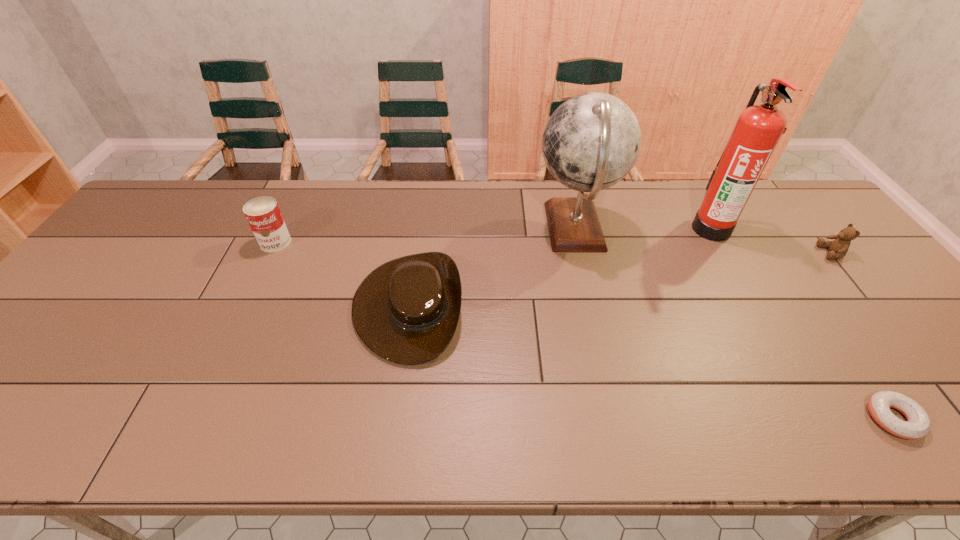
Select which object appears as the closest to the fourth object from right to left. Please provide its 2D coordinates. Your answer should be formatted as a tuple, i.e. [(x, y)], where the tuple contains the x and y coordinates of a point satisfying the conditions above.

[(407, 310)]

At what (x,y) coordinates should I click in order to perform the action: click on free point that satisfies the following two spatial constraints: 1. on the front label of the leftmost object; 2. on the right side of the fifth object from left to right. Please return your answer as a coordinate pair (x, y). Looking at the image, I should click on (190, 418).

Find the location of a particular element. This screenshot has width=960, height=540. free location that satisfies the following two spatial constraints: 1. on the front label of the fourth shortest object; 2. on the right side of the cowboy hat is located at coordinates (245, 306).

Identify the location of blank area in the image that satisfies the following two spatial constraints: 1. at the equator of the fourth object from right to left; 2. on the front label of the can. (578, 242).

Identify the location of free region that satisfies the following two spatial constraints: 1. on the front label of the second object from left to right; 2. on the right side of the leftmost object. Image resolution: width=960 pixels, height=540 pixels. (245, 306).

This screenshot has width=960, height=540. What are the coordinates of `vacant space that satisfies the following two spatial constraints: 1. with the nozzle pointing from the back of the third object from right to left; 2. on the right side of the doughnut` in the screenshot? It's located at (819, 418).